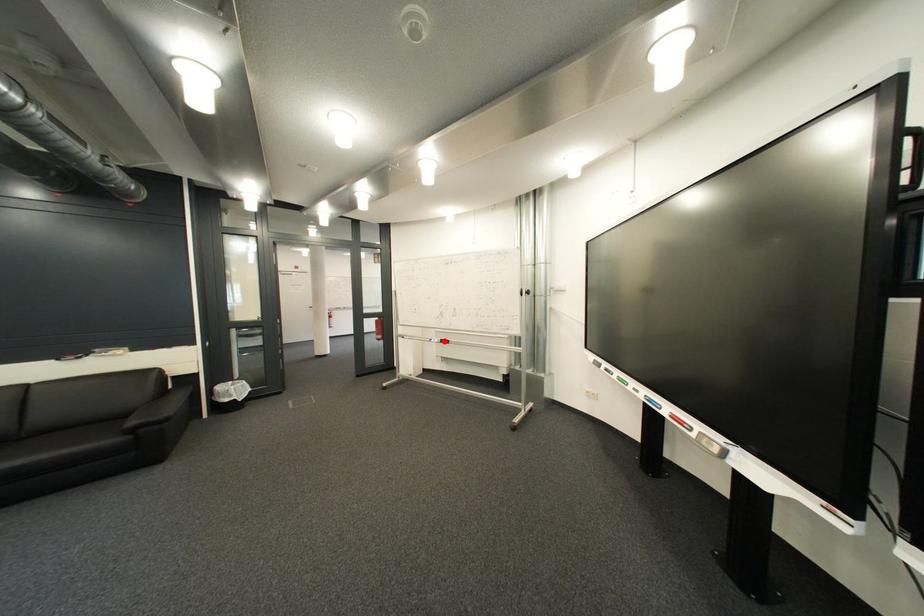
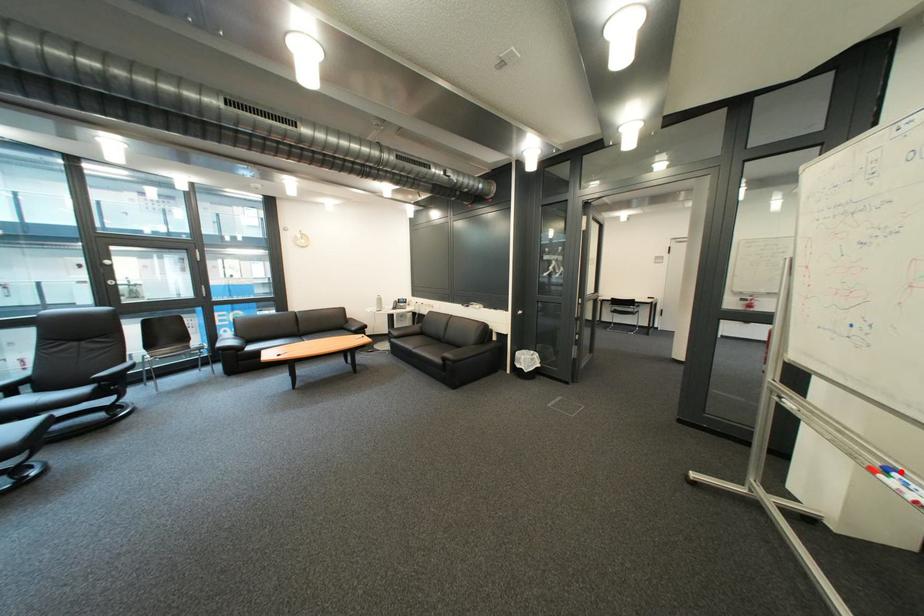
I am providing you with two images of the same scene from different viewpoints. A red point is marked on the first image and another point is marked on the second image. Is the red point in image1 aligned with the point shown in image2?

Yes